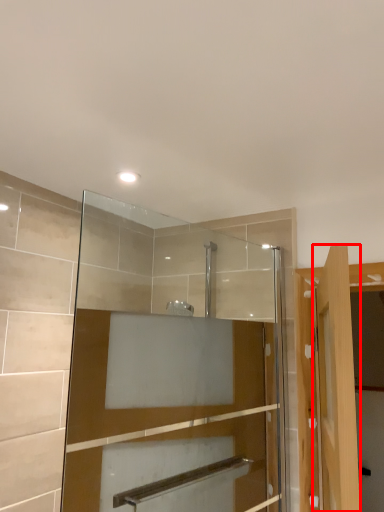
Question: Where is door (annotated by the red box) located in relation to mirror in the image?

Choices:
 (A) right
 (B) left

Answer: (A)